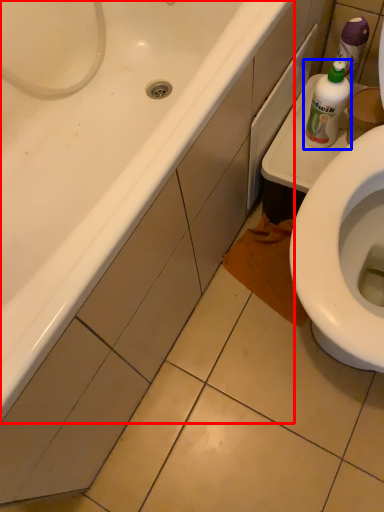
Question: Which object appears farthest to the camera in this image, bathtub (highlighted by a red box) or bottle (highlighted by a blue box)?

Choices:
 (A) bathtub
 (B) bottle

Answer: (B)